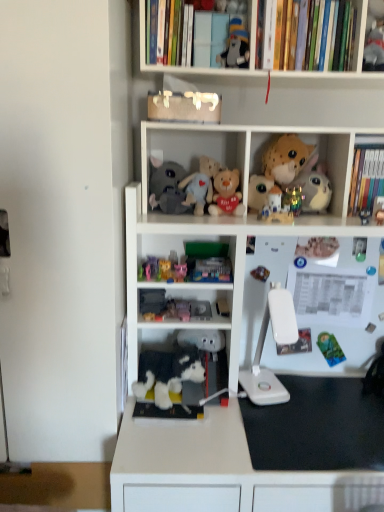
Question: Is spotted plush toy at upper right, the 10th toy when ordered from bottom to top, facing towards white plush toy at center, which ranks as the eleventh toy in top-to-bottom order?

Choices:
 (A) yes
 (B) no

Answer: (B)

Question: Is the depth of spotted plush toy at upper right, marked as the second toy in a top-to-bottom arrangement, less than that of white plush toy at center, which ranks as the eleventh toy in top-to-bottom order?

Choices:
 (A) no
 (B) yes

Answer: (A)

Question: Can you confirm if spotted plush toy at upper right, marked as the second toy in a top-to-bottom arrangement, is bigger than white plush toy at center, which appears as the 1th toy when ordered from the bottom?

Choices:
 (A) yes
 (B) no

Answer: (A)

Question: Does spotted plush toy at upper right, marked as the second toy in a top-to-bottom arrangement, appear on the right side of white plush toy at center, which appears as the 1th toy when ordered from the bottom?

Choices:
 (A) no
 (B) yes

Answer: (B)

Question: Is spotted plush toy at upper right, marked as the second toy in a top-to-bottom arrangement, directly adjacent to white plush toy at center, which ranks as the eleventh toy in top-to-bottom order?

Choices:
 (A) no
 (B) yes

Answer: (A)

Question: Is fluffy beige teddy bear at center, the eighth toy positioned from the bottom, in front of or behind metallic gold ornament at upper center, placed as the fifth toy when sorted from top to bottom, in the image?

Choices:
 (A) front
 (B) behind

Answer: (A)

Question: Is fluffy beige teddy bear at center, which ranks as the 4th toy in top-to-bottom order, to the left or to the right of metallic gold ornament at upper center, placed as the fifth toy when sorted from top to bottom, in the image?

Choices:
 (A) left
 (B) right

Answer: (A)

Question: In terms of height, does fluffy beige teddy bear at center, which ranks as the 4th toy in top-to-bottom order, look taller or shorter compared to metallic gold ornament at upper center, the seventh toy in the bottom-to-top sequence?

Choices:
 (A) short
 (B) tall

Answer: (B)

Question: Is point (238, 207) positioned closer to the camera than point (299, 194)?

Choices:
 (A) farther
 (B) closer

Answer: (B)

Question: Considering the positions of white plastic bookcase at center and hardcover books at upper right, positioned as the 1th book in left-to-right order, in the image, is white plastic bookcase at center wider or thinner than hardcover books at upper right, positioned as the 1th book in left-to-right order,?

Choices:
 (A) thin
 (B) wide

Answer: (B)

Question: Is white plastic bookcase at center inside or outside of hardcover books at upper right, the second book from the right?

Choices:
 (A) inside
 (B) outside

Answer: (B)

Question: From the image's perspective, is white plastic bookcase at center located above or below hardcover books at upper right, positioned as the 2th book in bottom-to-top order?

Choices:
 (A) below
 (B) above

Answer: (A)

Question: From a real-world perspective, relative to hardcover books at upper right, positioned as the 2th book in bottom-to-top order, is white plastic bookcase at center vertically above or below?

Choices:
 (A) above
 (B) below

Answer: (B)

Question: Considering the positions of point (379, 186) and point (248, 45), is point (379, 186) closer or farther from the camera than point (248, 45)?

Choices:
 (A) farther
 (B) closer

Answer: (A)

Question: Is hardcover book at upper right, acting as the first book starting from the right, taller or shorter than matte black plush at upper center, which ranks as the eleventh toy in bottom-to-top order?

Choices:
 (A) short
 (B) tall

Answer: (B)